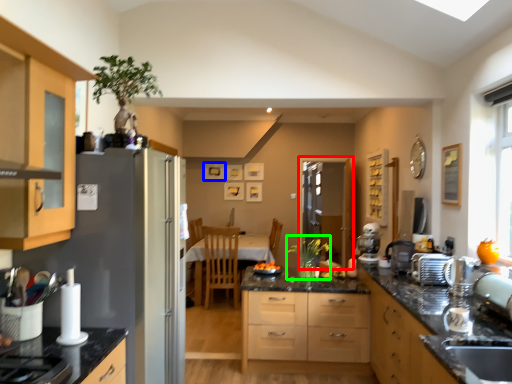
Question: Estimate the real-world distances between objects in this image. Which object is closer to screen door (highlighted by a red box), picture frame (highlighted by a blue box) or plant (highlighted by a green box)?

Choices:
 (A) picture frame
 (B) plant

Answer: (A)